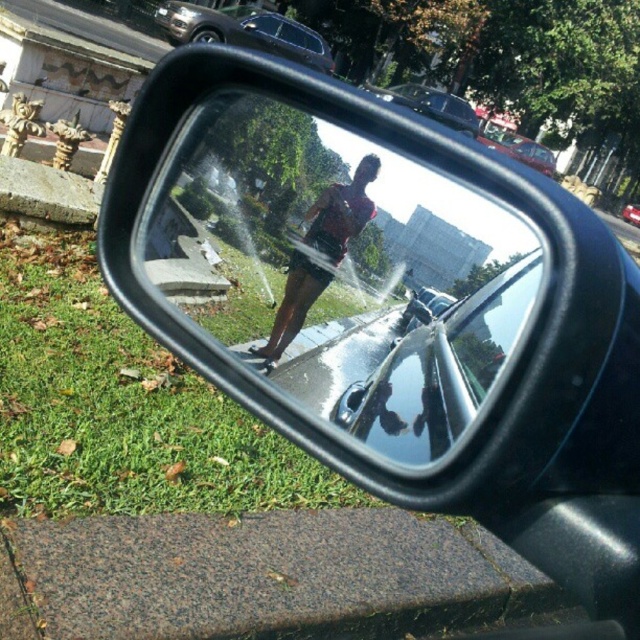
You are driving a car and looking at the side mirror. You see the matte black shorts at center and the metallic silver car at center in the reflection. Which object is closer to the mirror? Please explain your reasoning based on their positions.

The matte black shorts at center are closer to the mirror because they are positioned to the left of the metallic silver car at center in the reflection. In reflections, objects closer to the mirror appear farther away in the reflection, but their relative positions can indicate proximity. Since the shorts are to the left of the car, this suggests they are positioned nearer to the mirror compared to the car, which is further away from the mirror in reality but appears behind the shorts in the reflection.

You are a pedestrian standing near the fountain and looking at the car mirror. You see the matte black shorts at center and the metallic silver car at center. Which object is closer to the ground?

The matte black shorts at center is positioned under metallic silver car at center, so it is closer to the ground.

You are standing in front of the car mirror and see the point marked as point (x=320, y=252). What object in the scene does this point correspond to?

The point (x=320, y=252) corresponds to the matte black shorts at center.